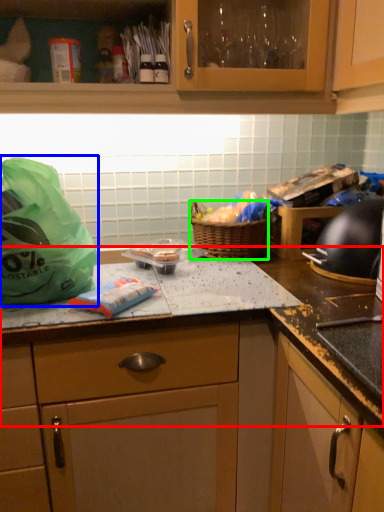
Question: Based on their relative distances, which object is farther from countertop (highlighted by a red box)? Choose from plastic bag (highlighted by a blue box) and picnic basket (highlighted by a green box).

Choices:
 (A) plastic bag
 (B) picnic basket

Answer: (A)